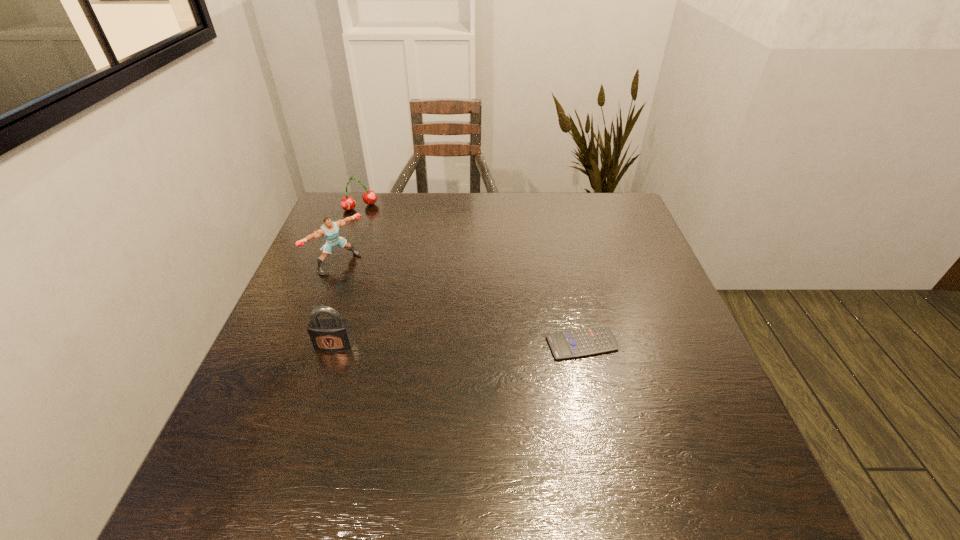
In the image, there is a desktop. What are the coordinates of `vacant area at the near edge` in the screenshot? It's located at (552, 413).

In the image, there is a desktop. Where is `vacant space at the left edge`? The height and width of the screenshot is (540, 960). vacant space at the left edge is located at coordinates (326, 262).

At what (x,y) coordinates should I click in order to perform the action: click on blank space at the right edge of the desktop. Please return your answer as a coordinate pair (x, y). This screenshot has width=960, height=540. Looking at the image, I should click on click(662, 336).

Locate an element on the screen. This screenshot has width=960, height=540. free space at the far left corner of the desktop is located at coordinates (345, 213).

This screenshot has height=540, width=960. What are the coordinates of `vacant area at the near left corner of the desktop` in the screenshot? It's located at (273, 418).

In the image, there is a desktop. Where is `vacant space at the far right corner`? This screenshot has width=960, height=540. vacant space at the far right corner is located at coordinates (635, 215).

The width and height of the screenshot is (960, 540). I want to click on free space between the padlock and the puncher, so click(x=336, y=303).

Where is `free spot between the rightmost object and the padlock`? This screenshot has height=540, width=960. free spot between the rightmost object and the padlock is located at coordinates (458, 344).

Where is `vacant region between the calculator and the padlock`? vacant region between the calculator and the padlock is located at coordinates click(x=458, y=344).

The width and height of the screenshot is (960, 540). Identify the location of free area in between the farthest object and the padlock. coord(348,276).